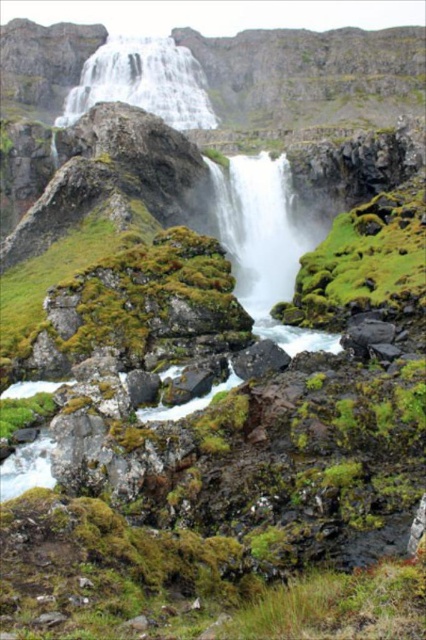
You are standing at the edge of the pool below the waterfall. You see the green mossy rock at center and the white smooth waterfall at center. Which object is located to the right of the other?

The green mossy rock at center is positioned on the right side of white smooth waterfall at center.

You are standing at the base of the waterfall and notice two points marked on the rocks. The first point is at coordinate point (x=362, y=269) and the second is at point (x=294, y=237). Which point is closer to you?

Point (x=362, y=269) is in front of point (x=294, y=237), so it is closer to you.

From the picture: You are standing at the base of the waterfall and see two points marked on the rocks. The first point is at coordinate point (284,262) and the second is at point (143,88). Which point is closer to you?

Point (284,262) is in front of point (143,88), so it is closer to you.